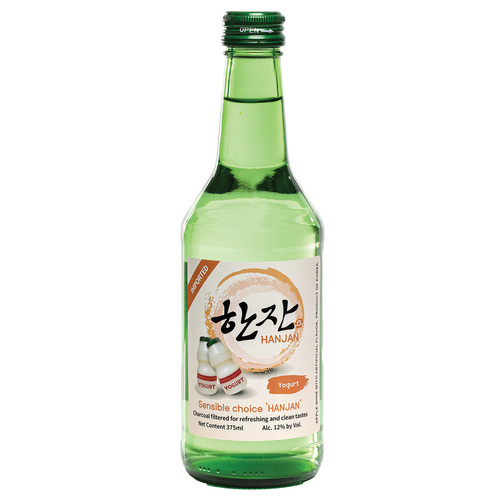
At what (x,y) coordinates should I click in order to perform the action: click on green bottle. Please return your answer as a coordinate pair (x, y). This screenshot has width=500, height=500. Looking at the image, I should click on (252, 208), (246, 463), (247, 85).